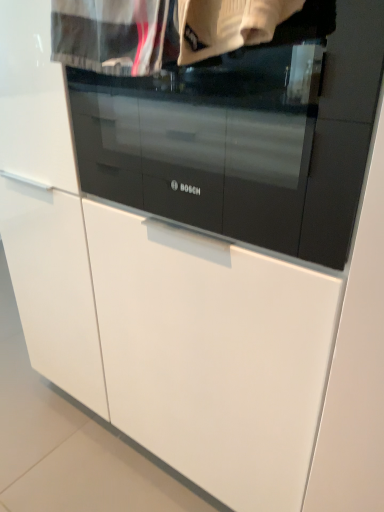
You are a GUI agent. You are given a task and a screenshot of the screen. Output one action in this format:
    pyautogui.click(x=<x>, y=<y>)
    Task: Click on the black glass oven at center
    
    Given the screenshot: What is the action you would take?
    pyautogui.click(x=245, y=134)

From a real-world perspective, who is located lower, white cotton shirt at upper center, the first clothing positioned from the left, or black glass oven at center?

black glass oven at center.

Do you think white cotton shirt at upper center, the 2th clothing positioned from the right, is within black glass oven at center, or outside of it?

white cotton shirt at upper center, the 2th clothing positioned from the right, is spatially situated outside black glass oven at center.

What's the angular difference between white cotton shirt at upper center, the first clothing positioned from the left, and black glass oven at center's facing directions?

They differ by 0.754 degrees in their facing directions.

Is point (104, 4) more distant than point (280, 54)?

Yes.

From the image's perspective, does black glass oven at center appear higher than white knitted sweater at upper center, positioned as the 2th clothing in left-to-right order?

No.

Can you confirm if black glass oven at center is taller than white knitted sweater at upper center, positioned as the 1th clothing in right-to-left order?

Yes.

Looking at this image, is black glass oven at center in front of or behind white knitted sweater at upper center, positioned as the 1th clothing in right-to-left order, in the image?

In the image, black glass oven at center appears behind white knitted sweater at upper center, positioned as the 1th clothing in right-to-left order.

Which object is wider, white knitted sweater at upper center, positioned as the 2th clothing in left-to-right order, or black glass oven at center?

black glass oven at center is wider.

Is white knitted sweater at upper center, positioned as the 2th clothing in left-to-right order, not within black glass oven at center?

white knitted sweater at upper center, positioned as the 2th clothing in left-to-right order, lies outside black glass oven at center's area.

Could you tell me if white knitted sweater at upper center, positioned as the 2th clothing in left-to-right order, is turned towards black glass oven at center?

No, white knitted sweater at upper center, positioned as the 2th clothing in left-to-right order, does not turn towards black glass oven at center.

Could you tell me if black glass oven at center is facing white cotton shirt at upper center, the 2th clothing positioned from the right?

Yes, black glass oven at center is oriented towards white cotton shirt at upper center, the 2th clothing positioned from the right.

From the image's perspective, would you say black glass oven at center is positioned over white cotton shirt at upper center, the first clothing positioned from the left?

No, from the image's perspective, black glass oven at center is not over white cotton shirt at upper center, the first clothing positioned from the left.

Considering the relative positions of black glass oven at center and white cotton shirt at upper center, the first clothing positioned from the left, in the image provided, is black glass oven at center to the left of white cotton shirt at upper center, the first clothing positioned from the left, from the viewer's perspective?

No, black glass oven at center is not to the left of white cotton shirt at upper center, the first clothing positioned from the left.

Between black glass oven at center and white cotton shirt at upper center, the 2th clothing positioned from the right, which one has smaller size?

With smaller size is white cotton shirt at upper center, the 2th clothing positioned from the right.

Considering the points (262, 25) and (130, 8), which point is in front, point (262, 25) or point (130, 8)?

The point (262, 25) is closer.

Where is `clothing located above the white knitted sweater at upper center, positioned as the 2th clothing in left-to-right order (from the image's perspective)`? The height and width of the screenshot is (512, 384). clothing located above the white knitted sweater at upper center, positioned as the 2th clothing in left-to-right order (from the image's perspective) is located at coordinates (109, 35).

Which of these two, white knitted sweater at upper center, positioned as the 1th clothing in right-to-left order, or white cotton shirt at upper center, the 2th clothing positioned from the right, is thinner?

white knitted sweater at upper center, positioned as the 1th clothing in right-to-left order, is thinner.

Is white knitted sweater at upper center, positioned as the 2th clothing in left-to-right order, turned away from white cotton shirt at upper center, the 2th clothing positioned from the right?

That's not correct — white knitted sweater at upper center, positioned as the 2th clothing in left-to-right order, is not looking away from white cotton shirt at upper center, the 2th clothing positioned from the right.

Based on the photo, is white cotton shirt at upper center, the first clothing positioned from the left, surrounding white knitted sweater at upper center, positioned as the 1th clothing in right-to-left order?

No.

Which point is more distant from viewer, (155, 3) or (192, 30)?

The point (192, 30) is farther.

In the image, there is a white knitted sweater at upper center, positioned as the 1th clothing in right-to-left order. Identify the location of clothing above it (from the image's perspective). pos(109,35).

Visually, is white cotton shirt at upper center, the 2th clothing positioned from the right, positioned to the left or to the right of white knitted sweater at upper center, positioned as the 1th clothing in right-to-left order?

Clearly, white cotton shirt at upper center, the 2th clothing positioned from the right, is on the left of white knitted sweater at upper center, positioned as the 1th clothing in right-to-left order, in the image.

Locate an element on the screen. clothing that is the 1st object above the black glass oven at center (from a real-world perspective) is located at coordinates (109, 35).

This screenshot has height=512, width=384. I want to click on oven directly beneath the white knitted sweater at upper center, positioned as the 1th clothing in right-to-left order (from a real-world perspective), so click(245, 134).

When comparing their distances from white knitted sweater at upper center, positioned as the 1th clothing in right-to-left order, does white cotton shirt at upper center, the first clothing positioned from the left, or black glass oven at center seem further?

The object further to white knitted sweater at upper center, positioned as the 1th clothing in right-to-left order, is black glass oven at center.

From the image, which object appears to be farther from black glass oven at center, white knitted sweater at upper center, positioned as the 2th clothing in left-to-right order, or white cotton shirt at upper center, the first clothing positioned from the left?

The object further to black glass oven at center is white cotton shirt at upper center, the first clothing positioned from the left.

Considering their positions, is white knitted sweater at upper center, positioned as the 2th clothing in left-to-right order, positioned further to white cotton shirt at upper center, the 2th clothing positioned from the right, than black glass oven at center?

black glass oven at center is positioned further to the anchor white cotton shirt at upper center, the 2th clothing positioned from the right.

Based on their spatial positions, is black glass oven at center or white cotton shirt at upper center, the 2th clothing positioned from the right, further from white knitted sweater at upper center, positioned as the 2th clothing in left-to-right order?

Based on the image, black glass oven at center appears to be further to white knitted sweater at upper center, positioned as the 2th clothing in left-to-right order.

Looking at the image, which one is located closer to black glass oven at center, white cotton shirt at upper center, the 2th clothing positioned from the right, or white knitted sweater at upper center, positioned as the 1th clothing in right-to-left order?

Among the two, white knitted sweater at upper center, positioned as the 1th clothing in right-to-left order, is located nearer to black glass oven at center.

Which object lies further to the anchor point white cotton shirt at upper center, the 2th clothing positioned from the right, black glass oven at center or white knitted sweater at upper center, positioned as the 1th clothing in right-to-left order?

black glass oven at center is further to white cotton shirt at upper center, the 2th clothing positioned from the right.

This screenshot has height=512, width=384. Identify the location of clothing located between white cotton shirt at upper center, the first clothing positioned from the left, and black glass oven at center in the left-right direction. (228, 25).